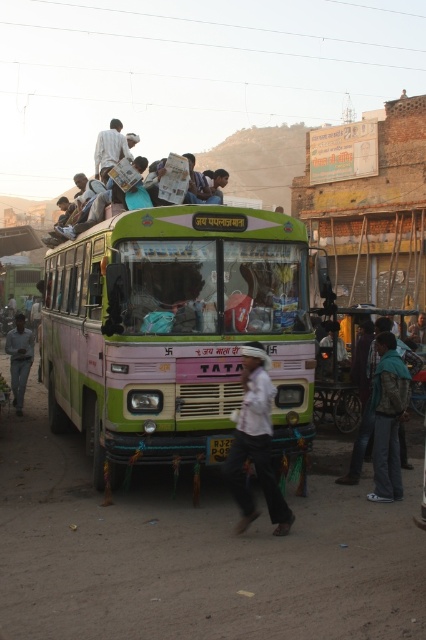
You are standing at the point with coordinates (175, 332). What object are you standing on?

You are standing on the green matte bus at center located at point (175, 332).

You are standing on the street and see two points marked on the bus. The first point is at coordinate point (181, 451) and the second is at point (233, 472). Which point is closer to you?

Point (181, 451) is closer to you because it is further to the viewer than point (233, 472).

In the scene shown: You are a photographer trying to capture a candid shot of the white cotton shirt at center and the light brown fabric bag at upper center. Which object should you focus on first if you want to ensure both are in focus without adjusting the camera settings?

The white cotton shirt at center is shorter than the light brown fabric bag at upper center, so focusing on the light brown fabric bag at upper center first will ensure both are in focus since it is farther away.